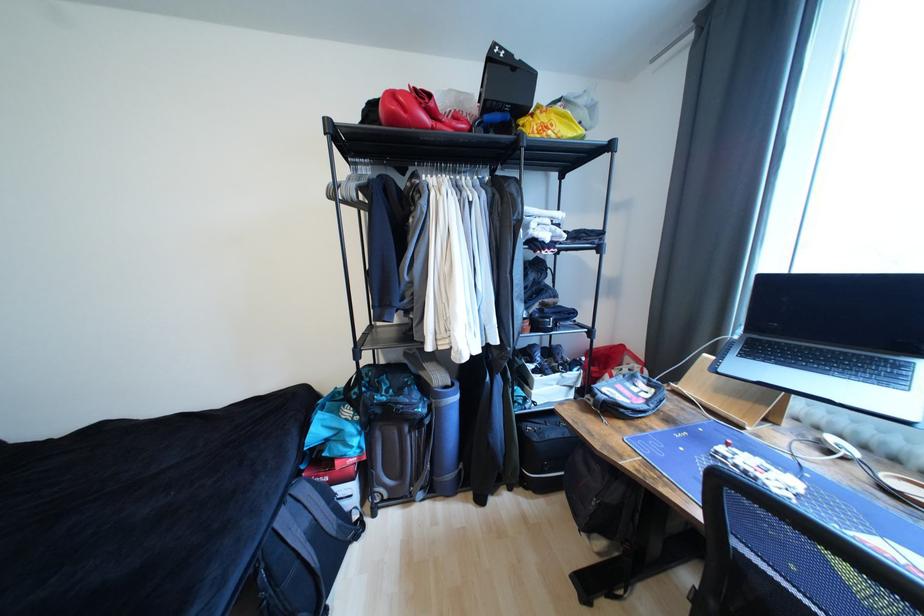
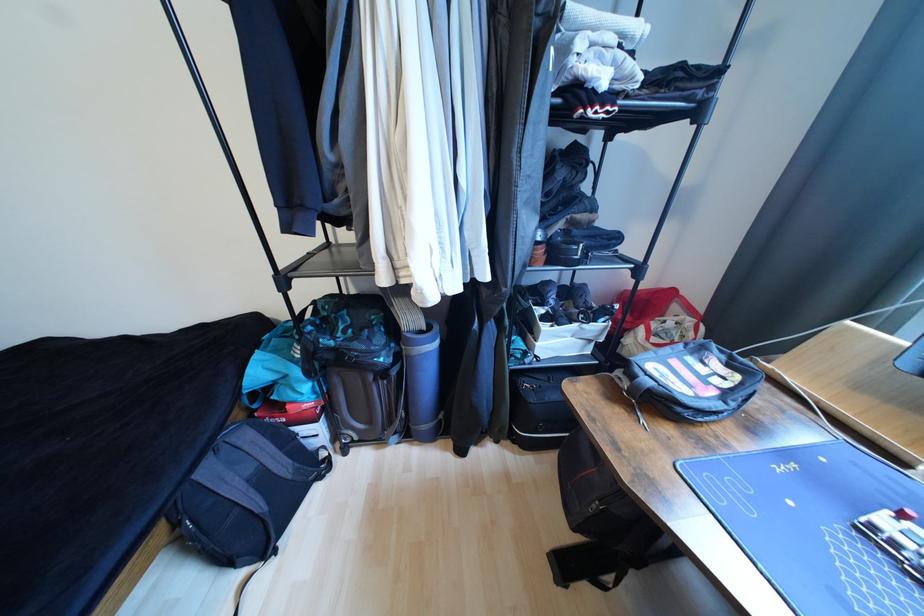
Question: In a continuous first-person perspective shot, in which direction is the camera moving?

Choices:
 (A) Left
 (B) Right
 (C) Forward
 (D) Backward

Answer: (C)